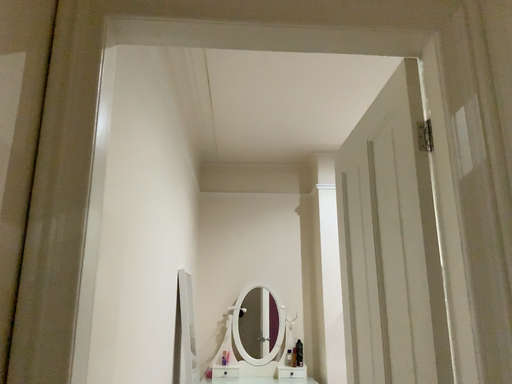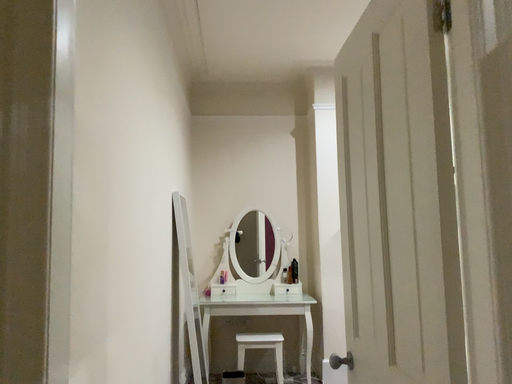
Question: Which way did the camera rotate in the video?

Choices:
 (A) rotated downward
 (B) rotated upward

Answer: (A)